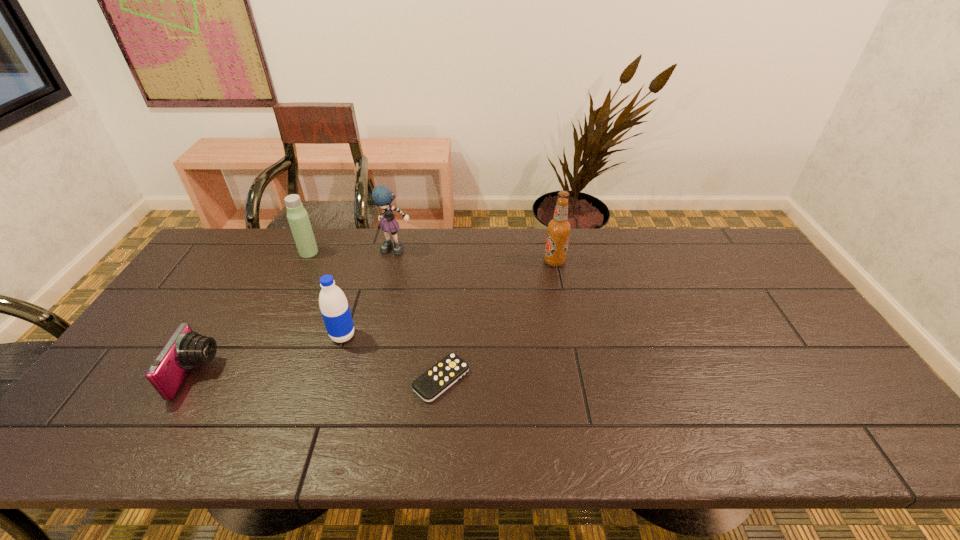
Locate an element on the screen. vacant region at the far edge of the desktop is located at coordinates point(562,267).

Identify the location of free space at the near edge of the desktop. (282, 452).

Find the location of `free region at the right edge`. free region at the right edge is located at coordinates (829, 381).

Identify the location of empty space that is in between the fifth tallest object and the rightmost object. (375, 318).

This screenshot has height=540, width=960. What are the coordinates of `unoccupied position between the third nearest object and the leftmost object` in the screenshot? It's located at (270, 355).

The height and width of the screenshot is (540, 960). I want to click on free area in between the rightmost object and the fifth object from left to right, so click(498, 320).

The image size is (960, 540). In order to click on vacant area between the second object from right to left and the rag doll in this screenshot , I will do `click(420, 314)`.

At what (x,y) coordinates should I click in order to perform the action: click on empty space that is in between the third nearest object and the beer bottle. Please return your answer as a coordinate pair (x, y). This screenshot has width=960, height=540. Looking at the image, I should click on (448, 299).

Where is `free space that is in between the beer bottle and the second shortest object`? free space that is in between the beer bottle and the second shortest object is located at coordinates (375, 318).

Image resolution: width=960 pixels, height=540 pixels. Identify the location of free space between the beer bottle and the fourth farthest object. (448, 299).